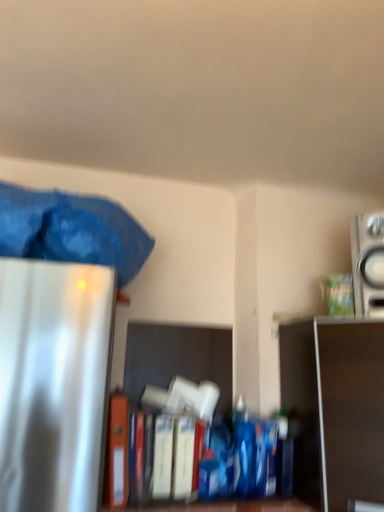
Question: From a real-world perspective, is silver metallic speaker at upper right positioned over metallic silver shelf at right based on gravity?

Choices:
 (A) yes
 (B) no

Answer: (A)

Question: Is silver metallic speaker at upper right taller than metallic silver shelf at right?

Choices:
 (A) no
 (B) yes

Answer: (A)

Question: Is silver metallic speaker at upper right wider than metallic silver shelf at right?

Choices:
 (A) yes
 (B) no

Answer: (B)

Question: Is silver metallic speaker at upper right not close to metallic silver shelf at right?

Choices:
 (A) no
 (B) yes

Answer: (A)

Question: Is silver metallic speaker at upper right at the right side of metallic silver shelf at right?

Choices:
 (A) no
 (B) yes

Answer: (B)

Question: Would you say orange matte file folder at center is to the left or to the right of blue fabric bag at upper left in the picture?

Choices:
 (A) right
 (B) left

Answer: (A)

Question: Is orange matte file folder at center taller or shorter than blue fabric bag at upper left?

Choices:
 (A) short
 (B) tall

Answer: (B)

Question: Would you say orange matte file folder at center is inside or outside blue fabric bag at upper left?

Choices:
 (A) outside
 (B) inside

Answer: (A)

Question: Is orange matte file folder at center in front of or behind blue fabric bag at upper left in the image?

Choices:
 (A) behind
 (B) front

Answer: (A)

Question: Visually, is metallic silver shelf at right positioned to the left or to the right of blue fabric bag at upper left?

Choices:
 (A) right
 (B) left

Answer: (A)

Question: From the image's perspective, is metallic silver shelf at right positioned above or below blue fabric bag at upper left?

Choices:
 (A) below
 (B) above

Answer: (A)

Question: From a real-world perspective, is metallic silver shelf at right positioned above or below blue fabric bag at upper left?

Choices:
 (A) above
 (B) below

Answer: (B)

Question: From their relative heights in the image, would you say metallic silver shelf at right is taller or shorter than blue fabric bag at upper left?

Choices:
 (A) short
 (B) tall

Answer: (B)

Question: In the image, is orange matte file folder at center on the left side or the right side of silver metallic speaker at upper right?

Choices:
 (A) left
 (B) right

Answer: (A)

Question: Is orange matte file folder at center wider or thinner than silver metallic speaker at upper right?

Choices:
 (A) thin
 (B) wide

Answer: (B)